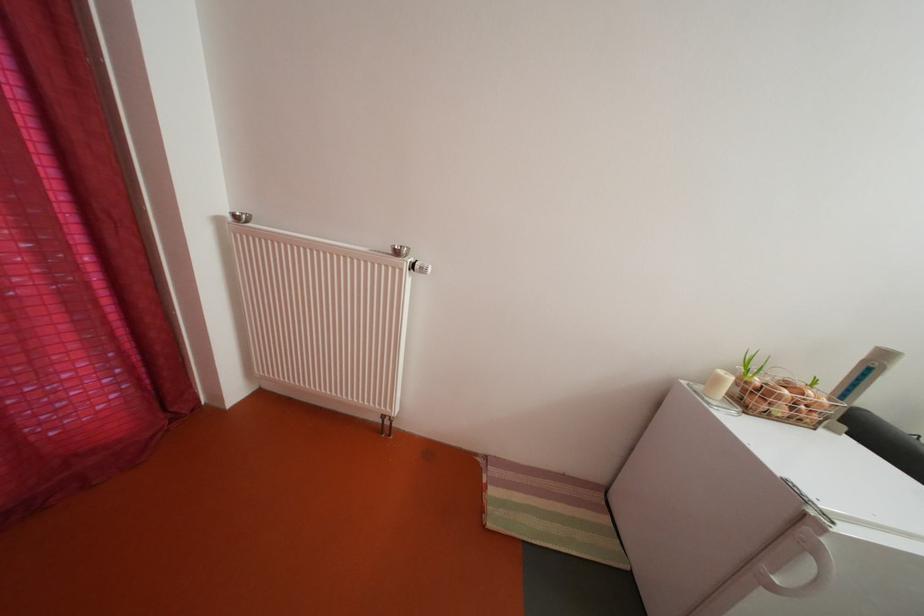
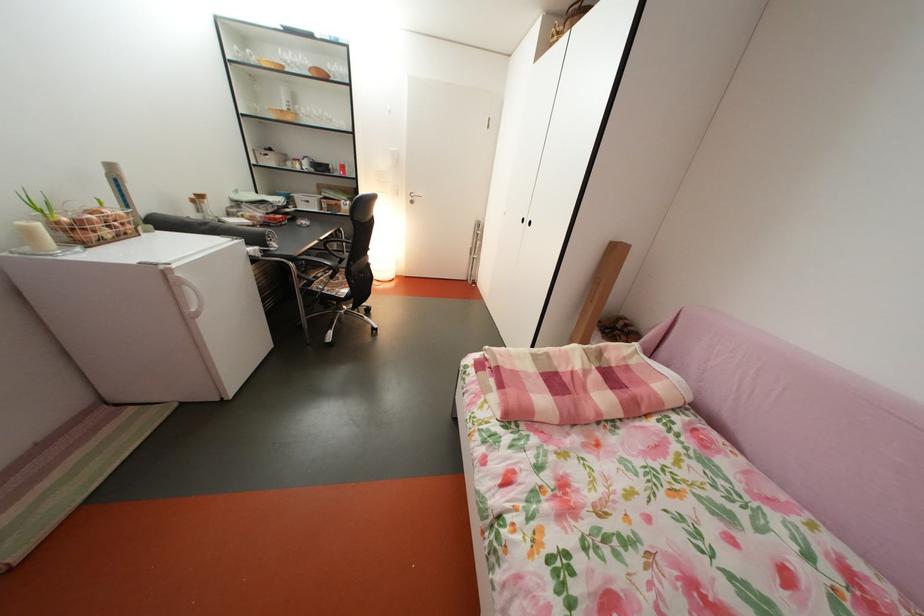
In the second image, find the point that corresponds to (x=728, y=386) in the first image.

(41, 238)